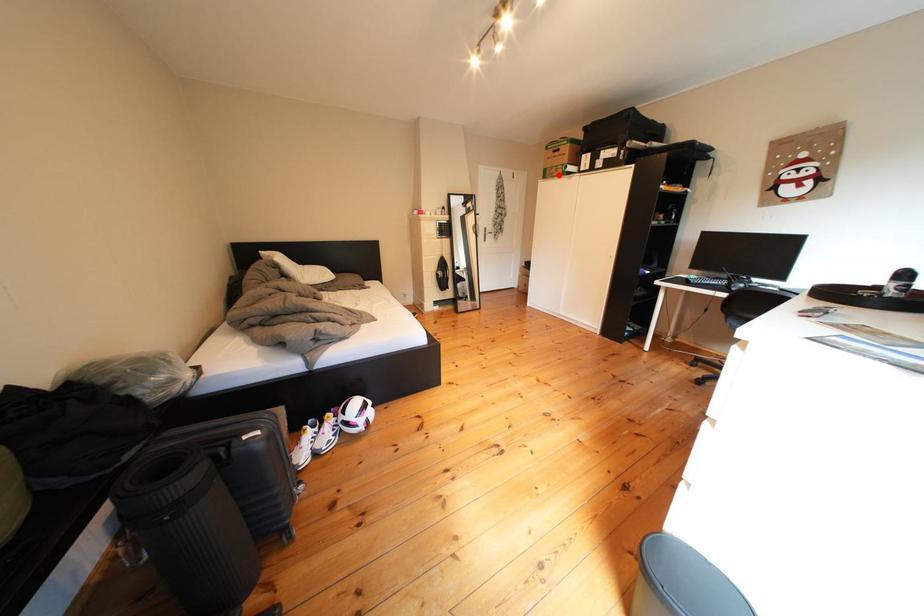
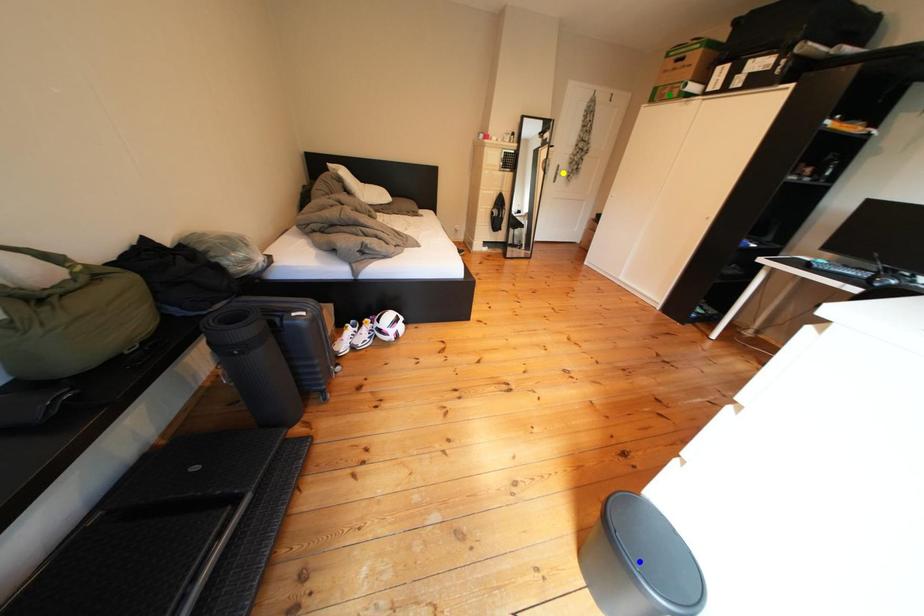
Question: I am providing you with two images of the same scene from different viewpoints. A red point is marked on the first image. You are given multiple points on the second image. Which point in image 2 represents the same 3d spot as the red point in image 1?

Choices:
 (A) green point
 (B) yellow point
 (C) blue point

Answer: (A)